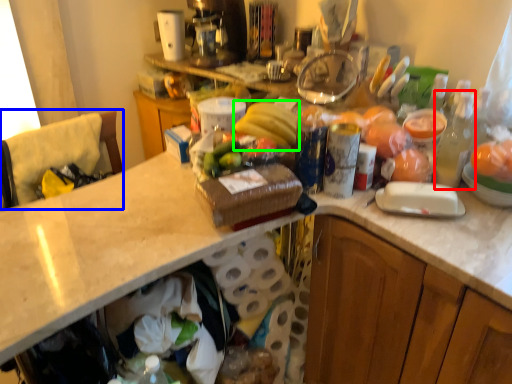
Question: Which is nearer to the bottle (highlighted by a red box)? leftover (highlighted by a blue box) or banana (highlighted by a green box).

Choices:
 (A) leftover
 (B) banana

Answer: (B)